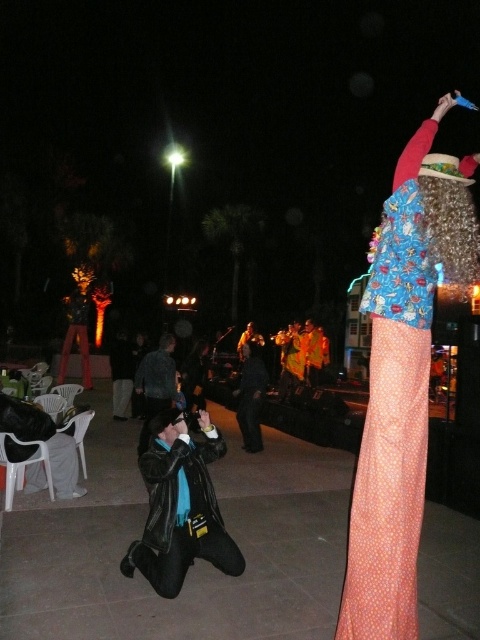
Question: Which point is closer to the camera?

Choices:
 (A) (259, 376)
 (B) (173, 580)
 (C) (309, 378)
 (D) (441, 234)

Answer: (D)

Question: Is dark blue leather jacket at center to the left of yellow fabric pants at center from the viewer's perspective?

Choices:
 (A) no
 (B) yes

Answer: (B)

Question: Is dark blue leather jacket at center to the left of yellow fabric pants at center from the viewer's perspective?

Choices:
 (A) no
 (B) yes

Answer: (B)

Question: Considering the real-world distances, which object is closest to the yellow fabric pants at center?

Choices:
 (A) denim jacket at center
 (B) polka dot fabric dress at right

Answer: (A)

Question: Considering the relative positions of denim jacket at center and yellow fabric pants at center in the image provided, where is denim jacket at center located with respect to yellow fabric pants at center?

Choices:
 (A) left
 (B) right

Answer: (A)

Question: Which point appears farthest from the camera in this image?

Choices:
 (A) (256, 436)
 (B) (224, 570)

Answer: (A)